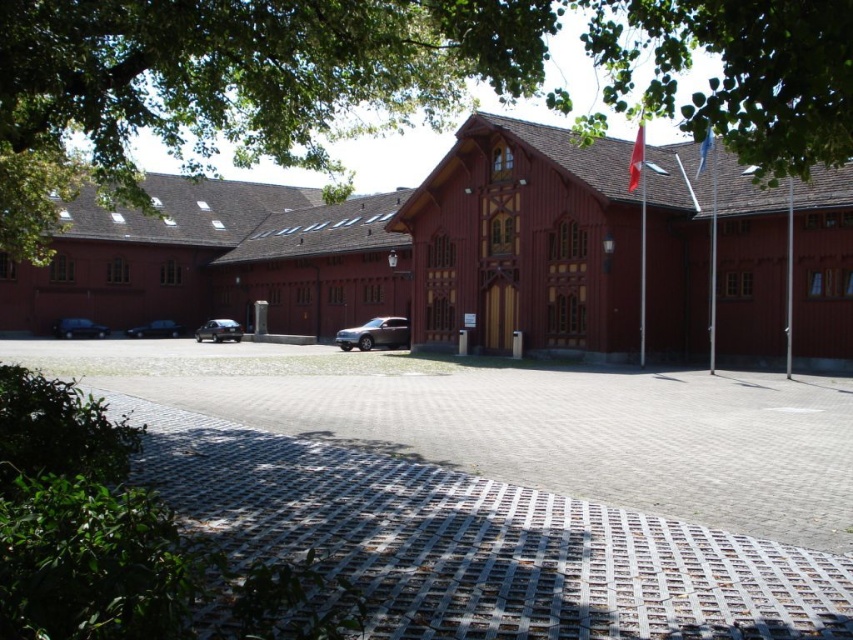
Question: Which object appears farthest from the camera in this image?

Choices:
 (A) satin black car at left
 (B) satin silver suv at center
 (C) shiny black car at lower left

Answer: (C)

Question: Which object is farther from the camera taking this photo?

Choices:
 (A) green leafy tree at upper center
 (B) shiny black car at lower left
 (C) satin silver suv at center
 (D) satin black car at left

Answer: (B)

Question: Does gray concrete driveway at center have a larger size compared to satin silver suv at center?

Choices:
 (A) yes
 (B) no

Answer: (A)

Question: Which point is closer to the camera?

Choices:
 (A) shiny black car at left
 (B) satin silver suv at center
 (C) shiny black car at lower left
 (D) gray concrete driveway at center

Answer: (D)

Question: Does gray concrete driveway at center have a smaller size compared to satin silver suv at center?

Choices:
 (A) yes
 (B) no

Answer: (B)

Question: Does gray concrete driveway at center have a greater width compared to satin black car at left?

Choices:
 (A) no
 (B) yes

Answer: (B)